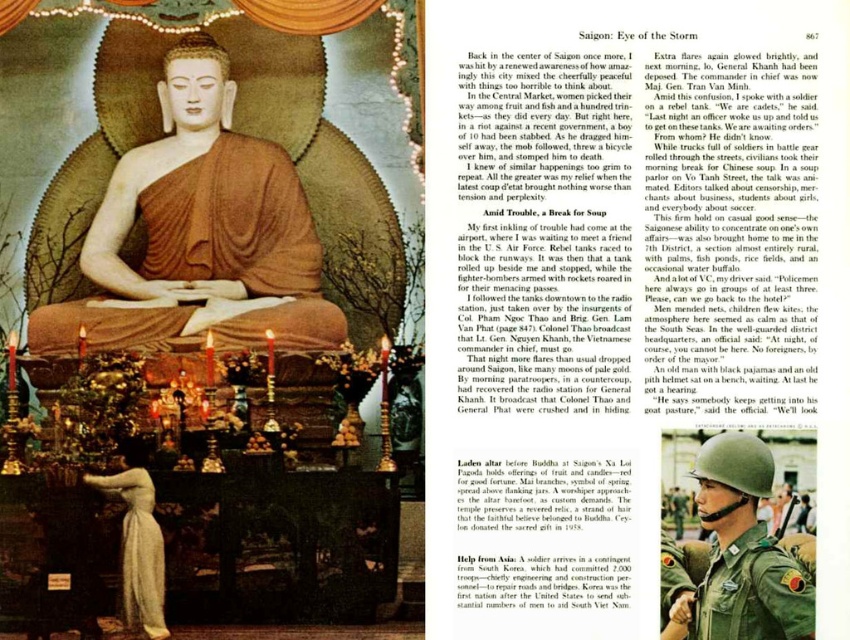
Question: Is matte gold statue at center to the right of green uniform helmet at center from the viewer's perspective?

Choices:
 (A) yes
 (B) no

Answer: (B)

Question: Which point is farther to the camera?

Choices:
 (A) green fabric helmet at center
 (B) green uniform helmet at center
 (C) matte gold statue at center

Answer: (C)

Question: Based on their relative distances, which object is farther from the green uniform helmet at center?

Choices:
 (A) green fabric helmet at center
 (B) matte gold statue at center

Answer: (B)

Question: Is matte gold statue at center to the left of green uniform helmet at center from the viewer's perspective?

Choices:
 (A) no
 (B) yes

Answer: (B)

Question: Does matte gold statue at center have a greater width compared to green fabric helmet at center?

Choices:
 (A) no
 (B) yes

Answer: (B)

Question: Among these objects, which one is farthest from the camera?

Choices:
 (A) green fabric helmet at center
 (B) matte gold statue at center
 (C) green uniform helmet at center

Answer: (B)